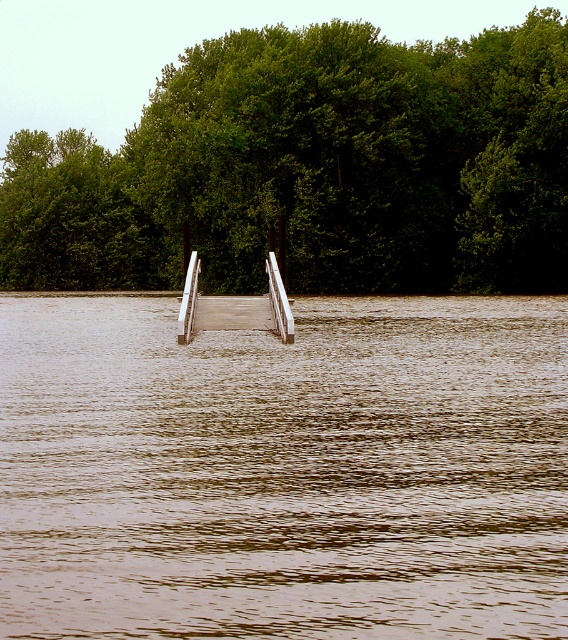
You are standing on the wooden dock in the image. You want to walk to the point marked by the coordinates (x=285, y=468). Based on the scene description, what type of surface will you be stepping onto when you reach that point?

The point at coordinates (x=285, y=468) corresponds to brown muddy water at center, so you will be stepping onto muddy water.

Looking at this image, you are standing on the wooden dock and looking around. Which object, the brown muddy water at center or the green leafy trees at center, is closer to the sky?

The brown muddy water at center is shorter than the green leafy trees at center, so the green leafy trees at center are closer to the sky.

You are standing on the wooden dock and notice the brown muddy water at center. Based on its coordinates, can you determine if the water is closer to the dock or the trees in the background?

The brown muddy water at center is located at point 0.734 on the x and 0.502 on the y axis. Since the dock is at the lower part of the image and the trees are in the background, the water is closer to the dock than the trees.